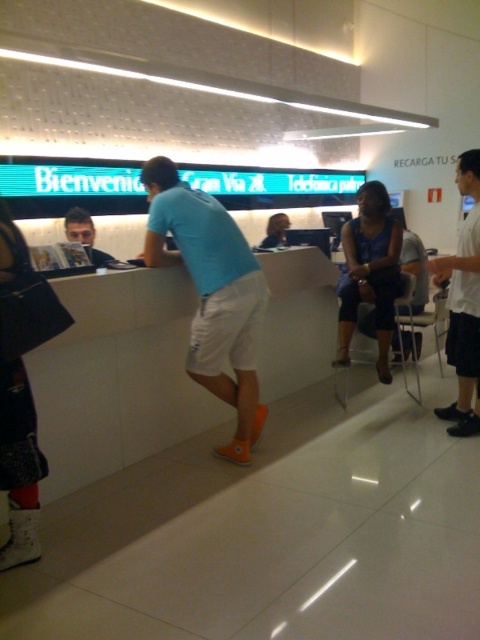
In the scene shown: You are a customer in a telecom store and want to ask an employee about a new phone plan. You see the light blue fabric shirt at center and the white short pants at right. Which clothing item is positioned lower on the person?

The light blue fabric shirt at center is below white short pants at right, so the light blue fabric shirt at center is positioned lower on the person.

You are a customer service representative at the desk. You need to determine which clothing item takes up more horizontal space between the light blue fabric shirt at center and the blue fabric dress at center. Which one should you choose?

The light blue fabric shirt at center has a larger width than the blue fabric dress at center, so the light blue fabric shirt at center takes up more horizontal space.

You are a customer standing in front of the reception desk. You notice the white short pants at right and the matte black book at left. Which object is positioned lower in the scene?

The white short pants at right is located below the matte black book at left, so it is positioned lower in the scene.